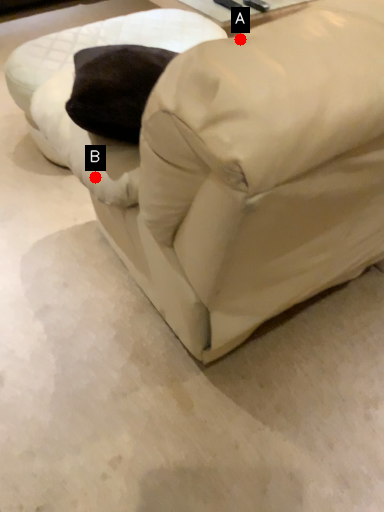
Question: Two points are circled on the image, labeled by A and B beside each circle. Which point is closer to the camera?

Choices:
 (A) A is closer
 (B) B is closer

Answer: (A)